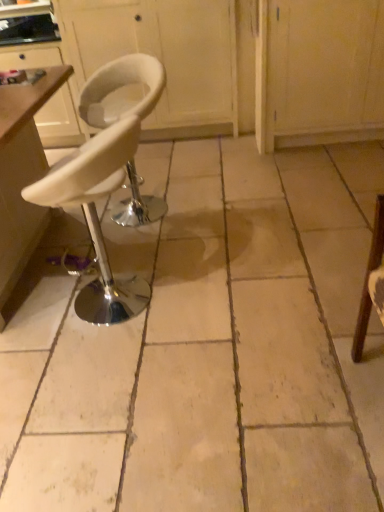
The image size is (384, 512). What are the coordinates of `vacant space in white matte stool at left, the first chair in the front-to-back sequence (from a real-world perspective)` in the screenshot? It's located at (122, 317).